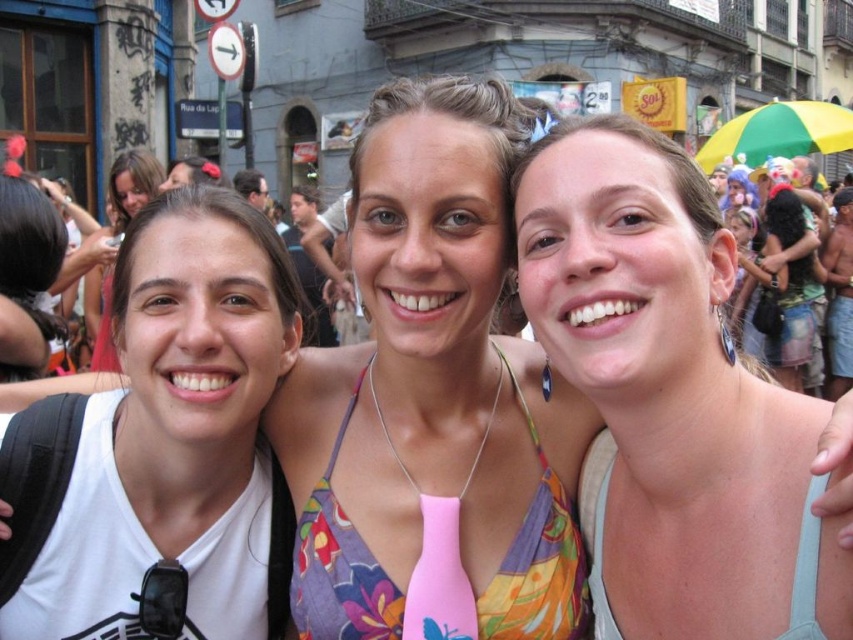
Based on the scene description, which object is bigger between the pink fabric top at center and the matte white tank top at left?

The pink fabric top at center is larger than the matte white tank top at left.

In the scene shown: You are a photographer trying to capture a photo of the pink fabric top at center and the matte white tank top at left. Based on their positions, which one is lower in the frame?

The pink fabric top at center is below the matte white tank top at left, so it is lower in the frame.